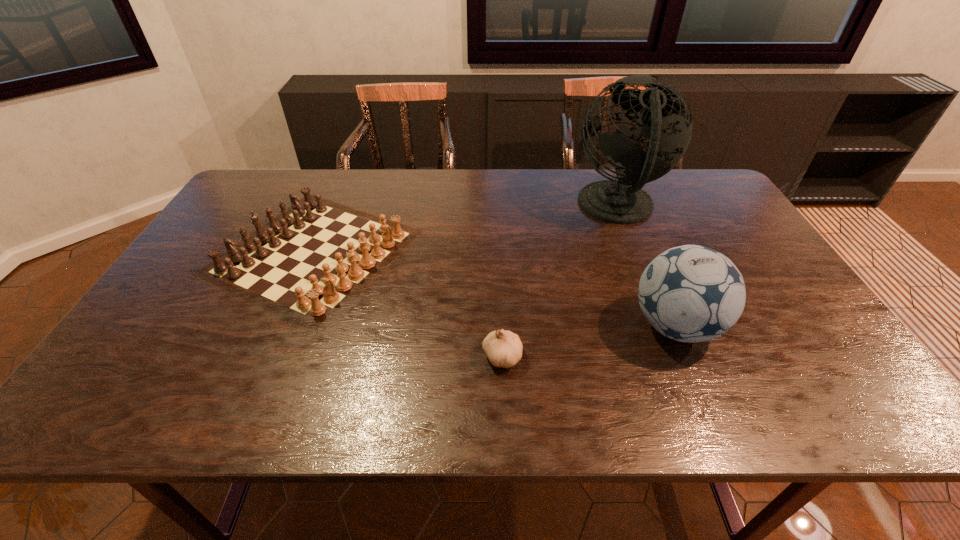
At what (x,y) coordinates should I click in order to perform the action: click on free space located on the side with brand of the soccer ball. Please return your answer as a coordinate pair (x, y). Looking at the image, I should click on (596, 326).

Locate an element on the screen. Image resolution: width=960 pixels, height=540 pixels. free space located on the side with brand of the soccer ball is located at coordinates (580, 326).

Image resolution: width=960 pixels, height=540 pixels. Find the location of `free space located 0.080m on the back of the leftmost object`. free space located 0.080m on the back of the leftmost object is located at coordinates (345, 181).

The image size is (960, 540). What are the coordinates of `vacant space located on the back of the garlic` in the screenshot? It's located at (498, 274).

Find the location of a particular element. This screenshot has height=540, width=960. globe located at the far edge is located at coordinates (658, 112).

Find the location of a particular element. chessboard located in the far edge section of the desktop is located at coordinates (309, 261).

The image size is (960, 540). What are the coordinates of `object at the left edge` in the screenshot? It's located at (309, 261).

This screenshot has height=540, width=960. Find the location of `object at the far left corner`. object at the far left corner is located at coordinates (309, 261).

Where is `vacant space at the far edge of the desktop`? Image resolution: width=960 pixels, height=540 pixels. vacant space at the far edge of the desktop is located at coordinates (535, 179).

At what (x,y) coordinates should I click in order to perform the action: click on blank area at the near edge. Please return your answer as a coordinate pair (x, y). The image size is (960, 540). Looking at the image, I should click on (548, 400).